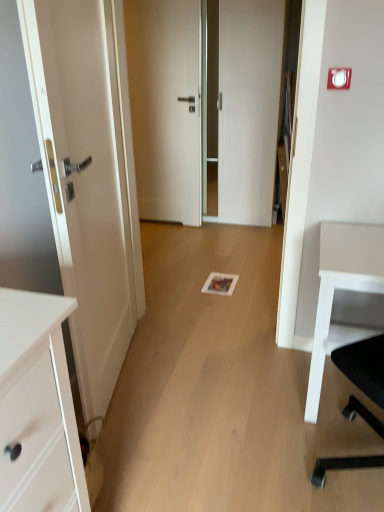
Image resolution: width=384 pixels, height=512 pixels. In order to click on empty space that is in between white glossy door at left, the 3th door from the back, and white matte desk at right in this screenshot , I will do click(x=208, y=387).